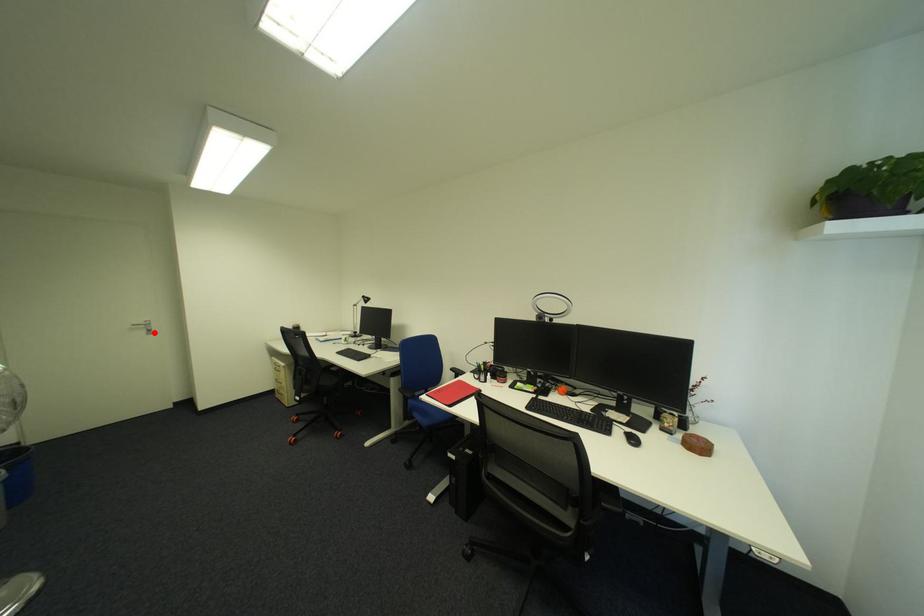
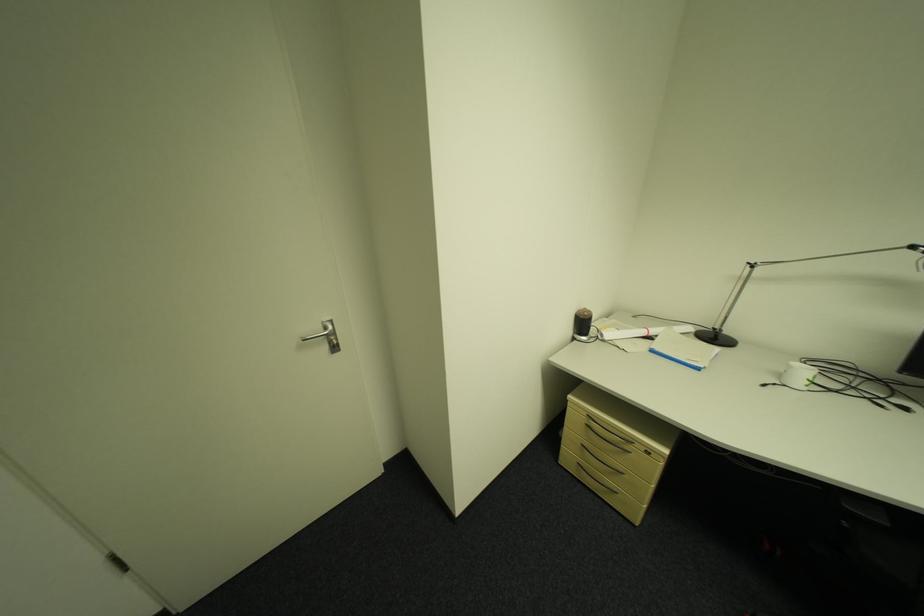
Locate, in the second image, the point that corresponds to the highlighted location in the first image.

(335, 349)